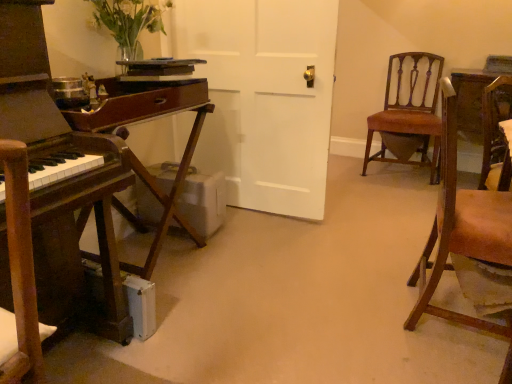
Locate an element on the screen. The image size is (512, 384). vacant area that lies between brown leather chair at right, positioned as the 1th chair in front-to-back order, and brown wood table at left is located at coordinates (297, 307).